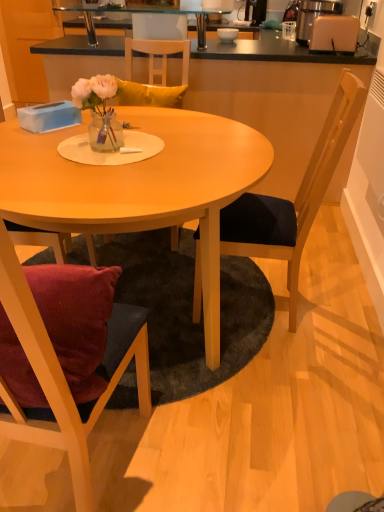
Locate an element on the screen. This screenshot has height=512, width=384. vacant area that is situated to the right of translucent glass vase at center is located at coordinates (168, 146).